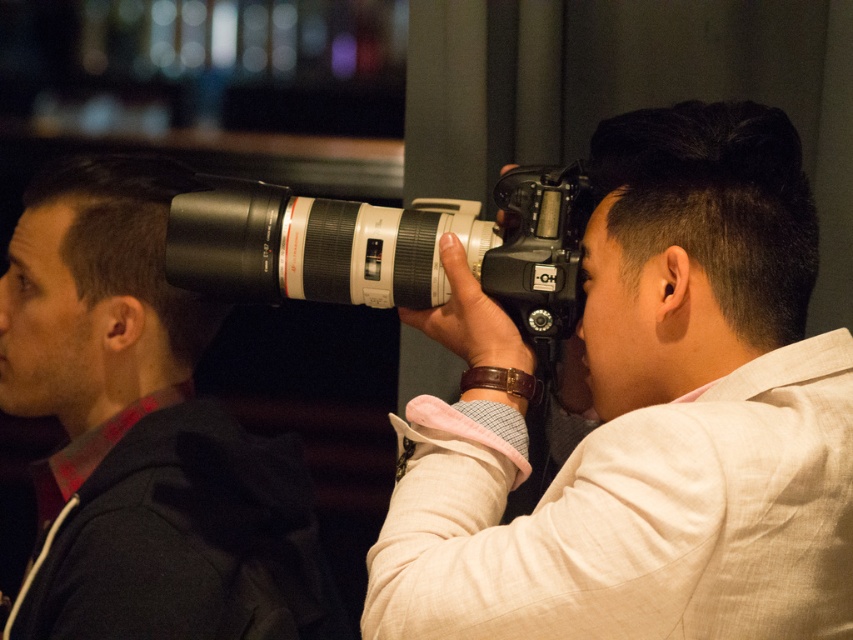
Question: Does matte black camera lens at upper left have a larger size compared to black plastic camera at center?

Choices:
 (A) no
 (B) yes

Answer: (B)

Question: In this image, where is matte black camera lens at upper left located relative to black plastic camera at center?

Choices:
 (A) right
 (B) left

Answer: (B)

Question: Based on their relative distances, which object is nearer to the matte black camera at center?

Choices:
 (A) matte black camera lens at upper left
 (B) black plastic camera at center

Answer: (B)

Question: Which point is closer to the camera?

Choices:
 (A) (218, 461)
 (B) (335, 257)

Answer: (B)

Question: Can you confirm if matte black camera at center is smaller than matte black camera lens at upper left?

Choices:
 (A) no
 (B) yes

Answer: (B)

Question: Which is farther from the matte black camera at center?

Choices:
 (A) matte black camera lens at upper left
 (B) black plastic camera at center

Answer: (A)